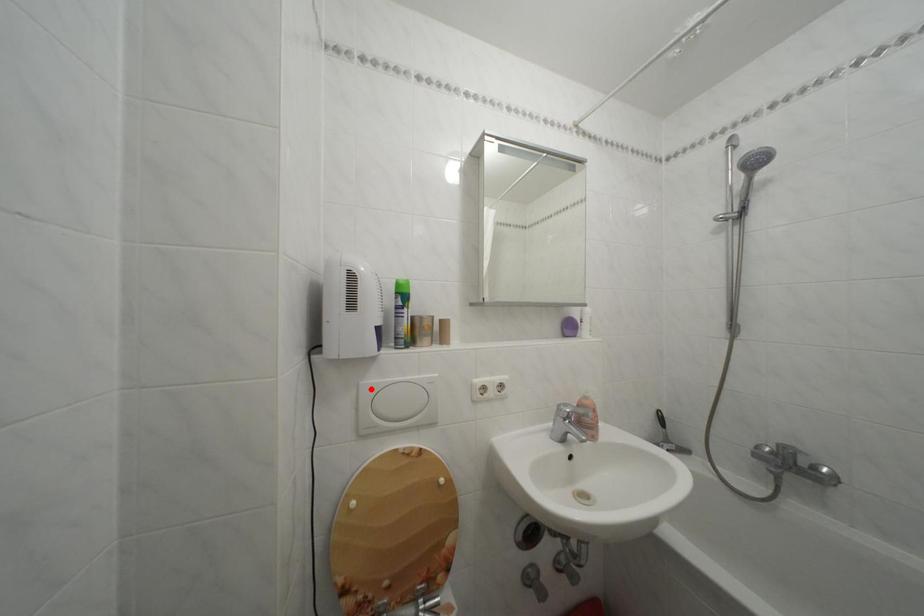
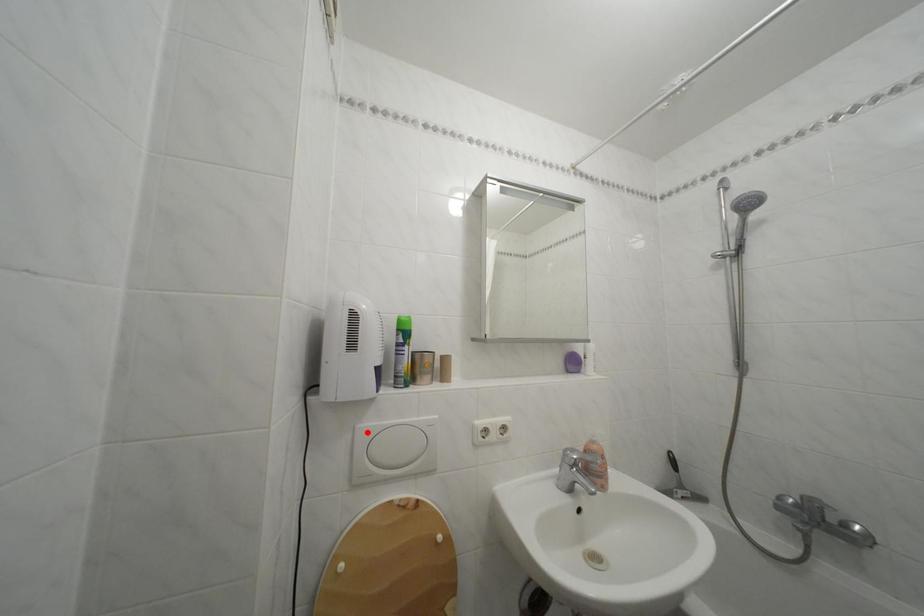
I am providing you with two images of the same scene from different viewpoints. A red point is marked on the first image and another point is marked on the second image. Are the points marked in image1 and image2 representing the same 3D position?

Yes